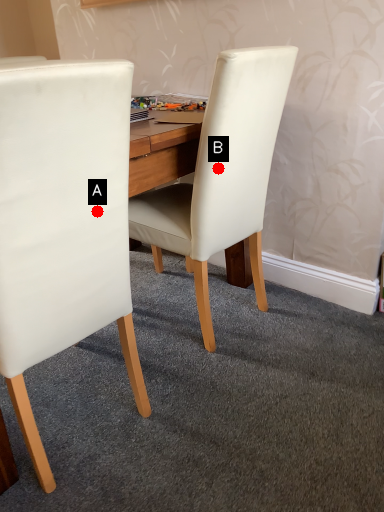
Question: Two points are circled on the image, labeled by A and B beside each circle. Which of the following is the closest to the observer?

Choices:
 (A) A is closer
 (B) B is closer

Answer: (A)